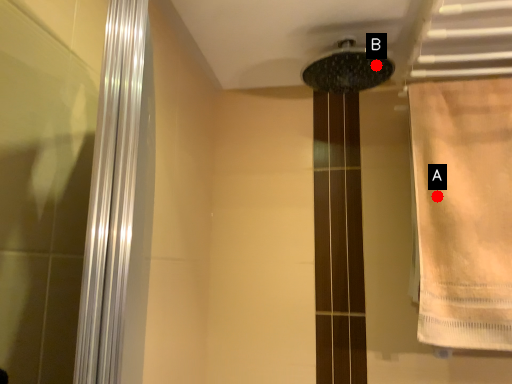
Question: Two points are circled on the image, labeled by A and B beside each circle. Which of the following is the closest to the observer?

Choices:
 (A) A is closer
 (B) B is closer

Answer: (B)